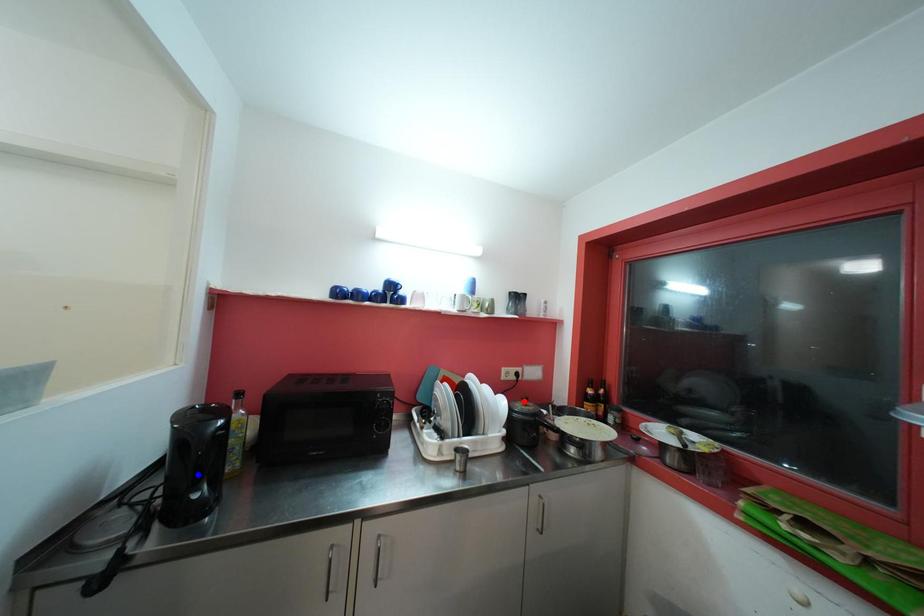
Question: In the image, two points are highlighted. Which point is nearer to the camera? Reply with the corresponding letter.

Choices:
 (A) blue point
 (B) red point

Answer: (A)